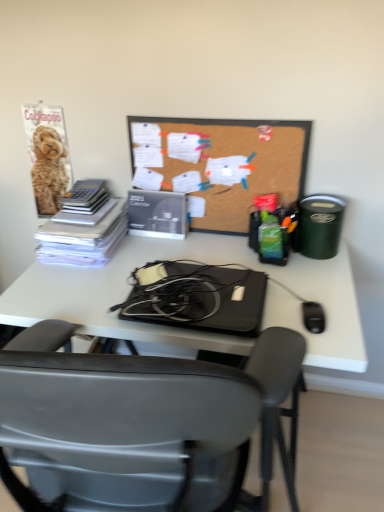
At what (x,y) coordinates should I click in order to perform the action: click on free spot above corkboard at center (from a real-world perspective). Please return your answer as a coordinate pair (x, y). The width and height of the screenshot is (384, 512). Looking at the image, I should click on (211, 106).